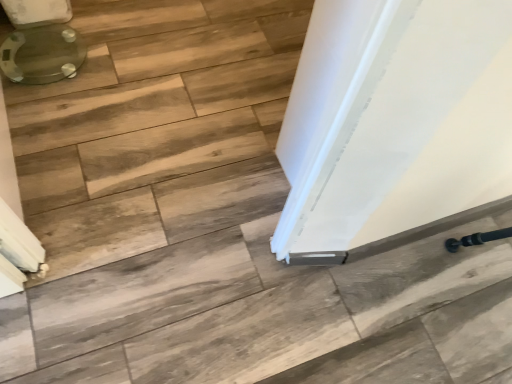
Question: From a real-world perspective, is translucent glass toilet at upper left physically below white glossy door at center?

Choices:
 (A) yes
 (B) no

Answer: (A)

Question: Does translucent glass toilet at upper left lie in front of white glossy door at center?

Choices:
 (A) yes
 (B) no

Answer: (B)

Question: Considering the relative sizes of translucent glass toilet at upper left and white glossy door at center in the image provided, is translucent glass toilet at upper left taller than white glossy door at center?

Choices:
 (A) no
 (B) yes

Answer: (A)

Question: Does translucent glass toilet at upper left have a smaller size compared to white glossy door at center?

Choices:
 (A) yes
 (B) no

Answer: (A)

Question: From the image's perspective, does translucent glass toilet at upper left appear lower than white glossy door at center?

Choices:
 (A) no
 (B) yes

Answer: (A)

Question: Can you confirm if translucent glass toilet at upper left is shorter than white glossy door at center?

Choices:
 (A) no
 (B) yes

Answer: (B)

Question: Does white glossy door at center appear on the right side of translucent glass toilet at upper left?

Choices:
 (A) no
 (B) yes

Answer: (B)

Question: Is white glossy door at center touching translucent glass toilet at upper left?

Choices:
 (A) no
 (B) yes

Answer: (A)

Question: Is there a large distance between white glossy door at center and translucent glass toilet at upper left?

Choices:
 (A) no
 (B) yes

Answer: (A)

Question: Is white glossy door at center facing away from translucent glass toilet at upper left?

Choices:
 (A) no
 (B) yes

Answer: (A)

Question: Is white glossy door at center aimed at translucent glass toilet at upper left?

Choices:
 (A) no
 (B) yes

Answer: (B)

Question: Can you confirm if white glossy door at center is positioned to the left of translucent glass toilet at upper left?

Choices:
 (A) no
 (B) yes

Answer: (A)

Question: Looking at the image, does translucent glass toilet at upper left seem bigger or smaller compared to white glossy door at center?

Choices:
 (A) big
 (B) small

Answer: (B)